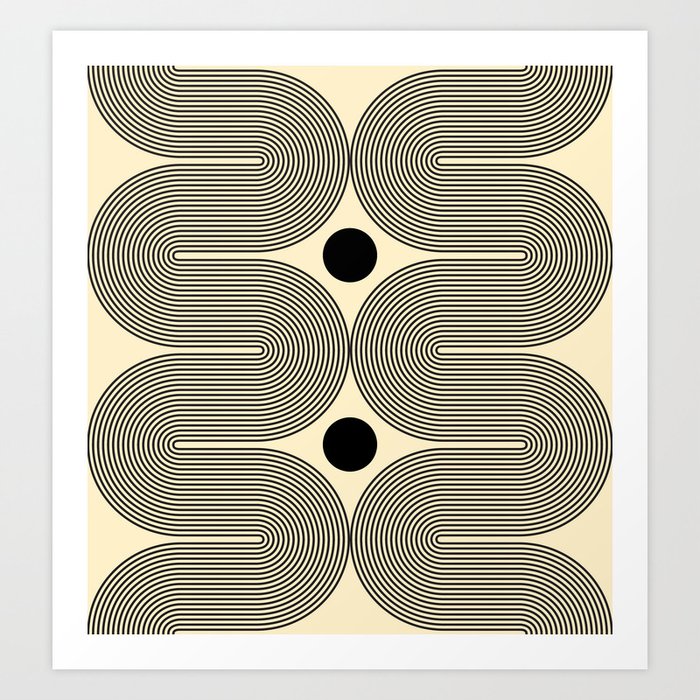
Locate an element on the screen. Image resolution: width=700 pixels, height=700 pixels. art piece is located at coordinates (496, 475).